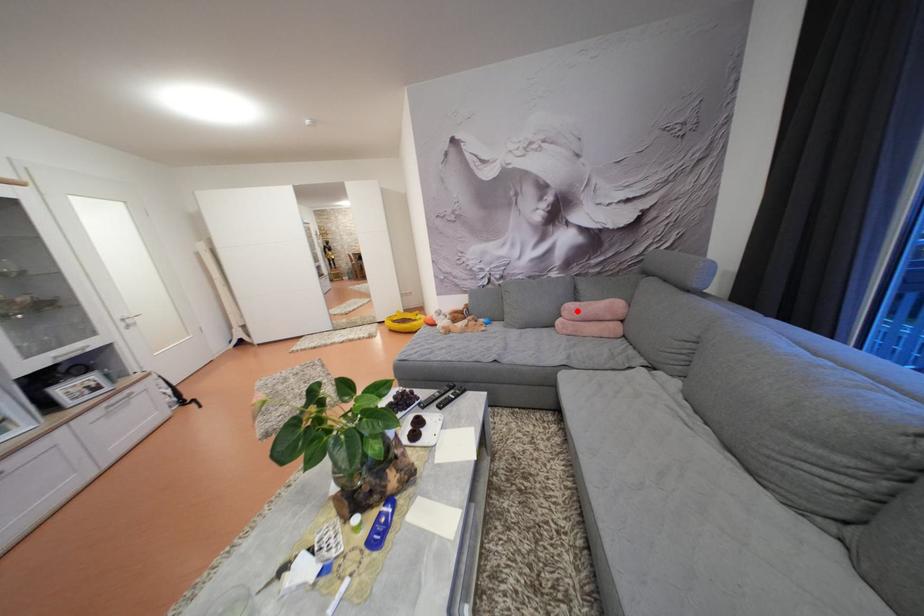
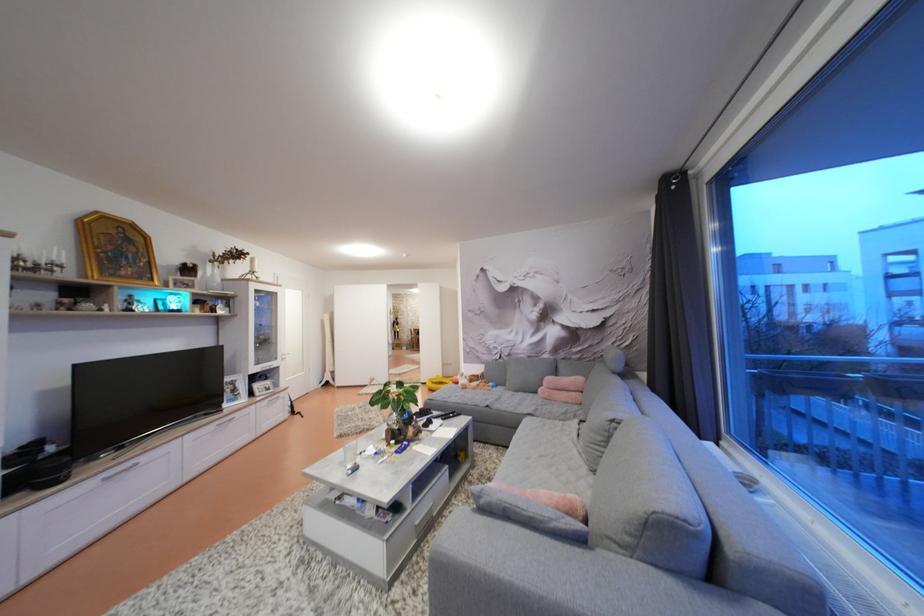
Where in the second image is the point corresponding to the highlighted location from the first image?

(556, 384)